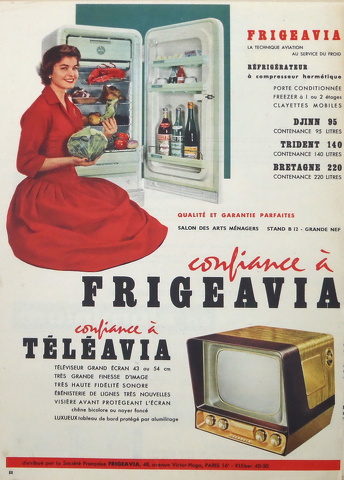
Where is `television`? television is located at coordinates (305, 377).